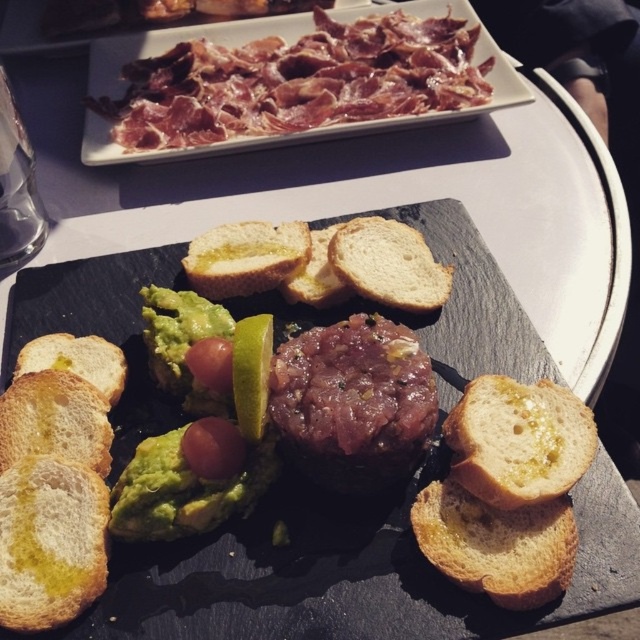
You are a food critic analyzing the presentation of this appetizer. The dish has both green creamy guacamole at center and golden crusty bread at center. Based on their positions and sizes, which one is more likely to spill over the edge of the plate?

The green creamy guacamole at center is thinner than golden crusty bread at center, so it is less likely to spill over the edge of the plate compared to the bread.

You are holding a pair of tongs that can reach up to 28 inches. You need to pick up the bread located at point (x=225, y=506). Can your tongs reach it?

The distance between the viewer and point (x=225, y=506) is 29.69 inches, which is beyond the tongs maximum reach of 28 inches. Therefore, the tongs cannot reach the bread at point (x=225, y=506).

You are a food critic who wants to compare the breads on the plate. Which bread is thinner between the yellow olive oil bread at lower left and the golden crusty bread at center?

The yellow olive oil bread at lower left is thinner than the golden crusty bread at center according to the description.